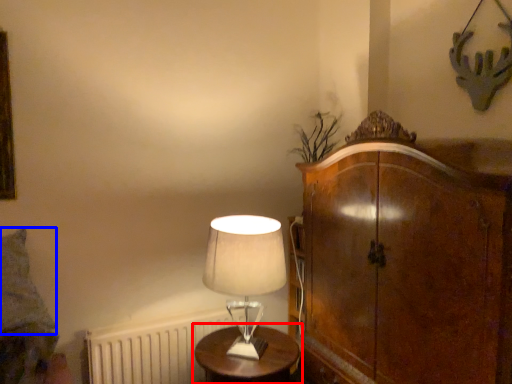
Question: Which point is closer to the camera, table (highlighted by a red box) or pillow (highlighted by a blue box)?

Choices:
 (A) table
 (B) pillow

Answer: (B)